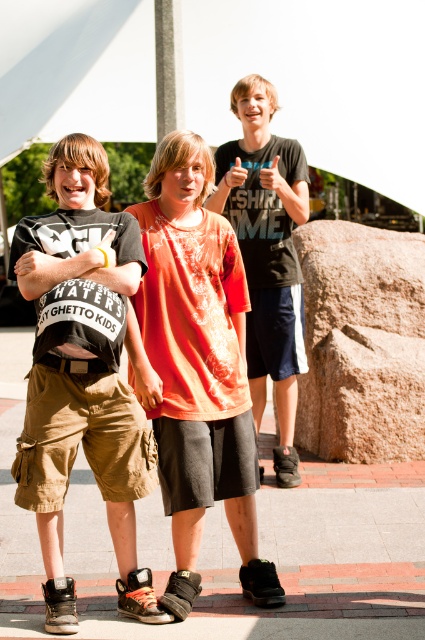
You are standing at the point labeled point (272, 148) and want to walk towards the point labeled point (195, 412). Which direction should you move relative to your current position?

You should move forward because point (195, 412) is in front of point (272, 148).